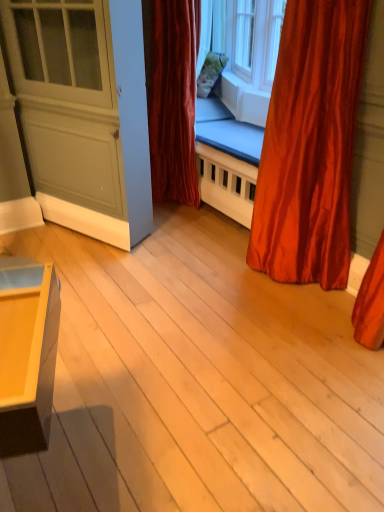
The width and height of the screenshot is (384, 512). I want to click on free point below satin red curtain at right, positioned as the first curtain in right-to-left order (from a real-world perspective), so click(288, 288).